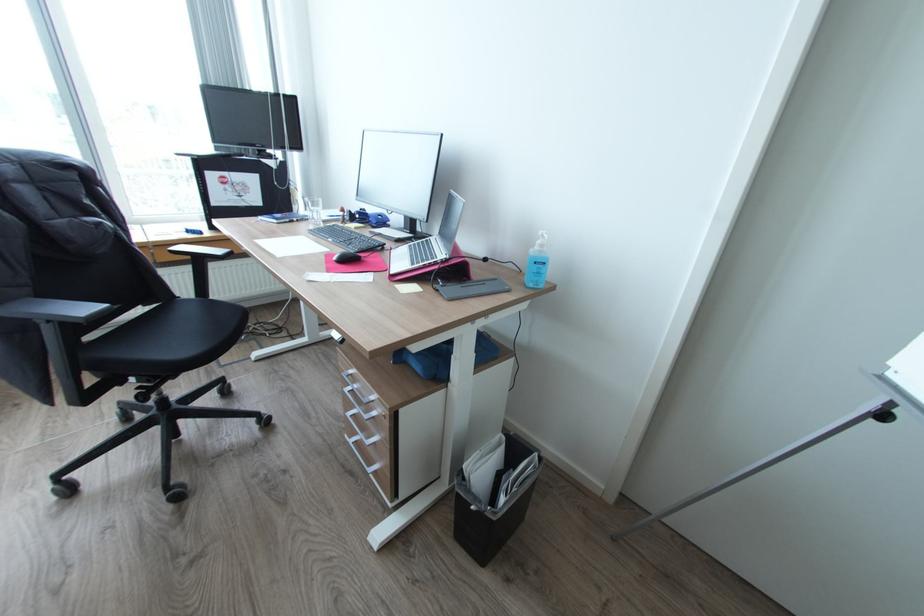
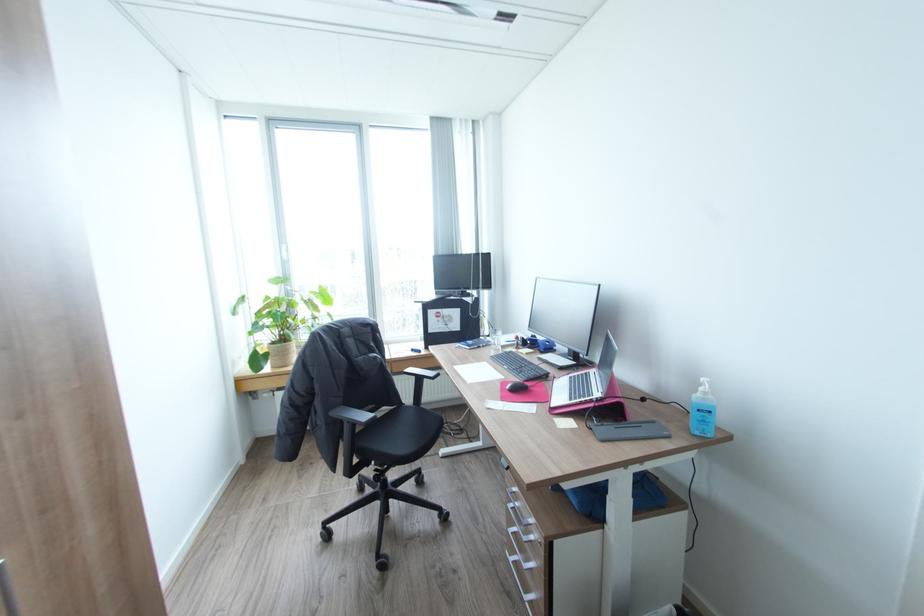
Find the pixel in the second image that matches pixel 55 321 in the first image.

(354, 422)